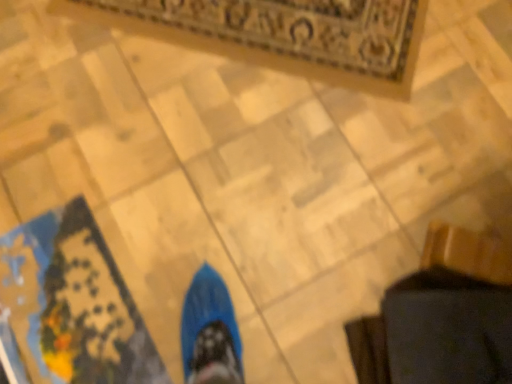
Question: Considering the relative sizes of carpeted mat at upper center, which appears as the 2th mat when ordered from the bottom, and blue fabric mat at lower left, which appears as the first mat when ordered from the bottom, in the image provided, is carpeted mat at upper center, which appears as the 2th mat when ordered from the bottom, bigger than blue fabric mat at lower left, which appears as the first mat when ordered from the bottom,?

Choices:
 (A) yes
 (B) no

Answer: (A)

Question: Is carpeted mat at upper center, the 1th mat viewed from the top, facing away from blue fabric mat at lower left, placed as the second mat when sorted from top to bottom?

Choices:
 (A) no
 (B) yes

Answer: (A)

Question: From the image's perspective, is carpeted mat at upper center, the 1th mat viewed from the top, beneath blue fabric mat at lower left, placed as the second mat when sorted from top to bottom?

Choices:
 (A) yes
 (B) no

Answer: (B)

Question: From the image's perspective, does carpeted mat at upper center, which is the first mat from back to front, appear higher than blue fabric mat at lower left, placed as the second mat when sorted from back to front?

Choices:
 (A) yes
 (B) no

Answer: (A)

Question: Is blue fabric mat at lower left, acting as the first mat starting from the front, a part of carpeted mat at upper center, the 1th mat viewed from the top?

Choices:
 (A) no
 (B) yes

Answer: (A)

Question: Does carpeted mat at upper center, which is the 2th mat in front-to-back order, lie in front of blue fabric mat at lower left, acting as the first mat starting from the front?

Choices:
 (A) yes
 (B) no

Answer: (B)

Question: Does blue fabric mat at lower left, placed as the second mat when sorted from top to bottom, lie behind carpeted mat at upper center, which is the 2th mat in front-to-back order?

Choices:
 (A) no
 (B) yes

Answer: (A)

Question: Is blue fabric mat at lower left, placed as the second mat when sorted from back to front, oriented towards carpeted mat at upper center, which is the first mat from back to front?

Choices:
 (A) no
 (B) yes

Answer: (B)

Question: Is carpeted mat at upper center, which is the first mat from back to front, a part of blue fabric mat at lower left, placed as the second mat when sorted from top to bottom?

Choices:
 (A) no
 (B) yes

Answer: (A)

Question: From a real-world perspective, is blue fabric mat at lower left, which appears as the first mat when ordered from the bottom, physically below carpeted mat at upper center, which is the first mat from back to front?

Choices:
 (A) yes
 (B) no

Answer: (B)

Question: From a real-world perspective, is blue fabric mat at lower left, placed as the second mat when sorted from top to bottom, on carpeted mat at upper center, the 1th mat viewed from the top?

Choices:
 (A) no
 (B) yes

Answer: (B)

Question: Is blue fabric mat at lower left, placed as the second mat when sorted from back to front, not within carpeted mat at upper center, which is the 2th mat in front-to-back order?

Choices:
 (A) no
 (B) yes

Answer: (B)

Question: Considering the positions of carpeted mat at upper center, the 1th mat viewed from the top, and blue fabric mat at lower left, acting as the first mat starting from the front, in the image, is carpeted mat at upper center, the 1th mat viewed from the top, bigger or smaller than blue fabric mat at lower left, acting as the first mat starting from the front,?

Choices:
 (A) small
 (B) big

Answer: (B)